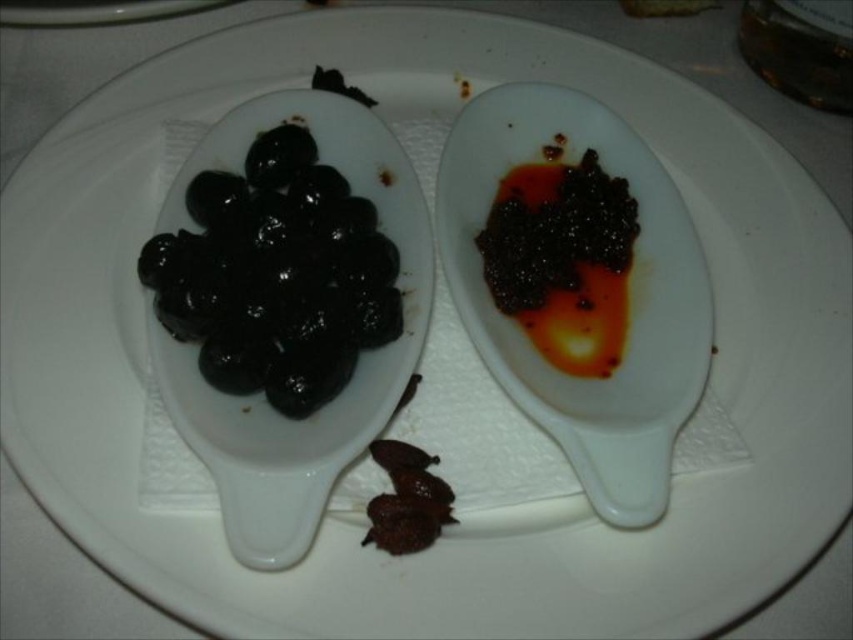
You are a food critic observing the image. You need to describe the spatial relationship between the white glossy spoon at upper right and the shiny brown olives at lower center. Which one is positioned higher?

The white glossy spoon at upper right is positioned higher than the shiny brown olives at lower center.

You are a food critic who needs to taste both the shiny black caviar at right and the shiny brown olives at lower center. If your hand can reach 12 inches, can you reach both items without moving your hand?

The distance between the shiny black caviar at right and the shiny brown olives at lower center is 14.25 inches. Since your hand can only reach 12 inches, you cannot reach both items without moving your hand.